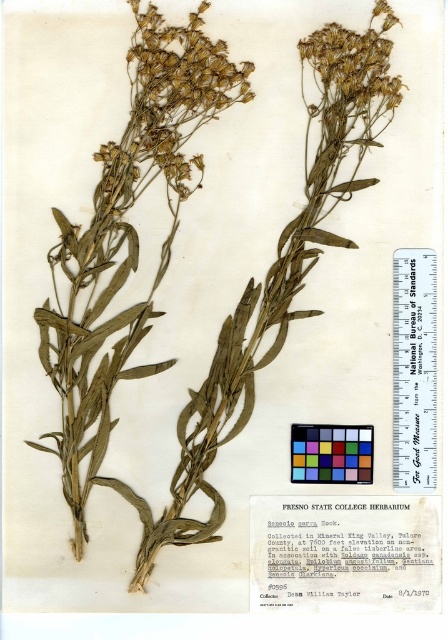
Question: Which object is positioned farthest from the metallic silver ruler at center-right?

Choices:
 (A) dry grass at upper center
 (B) dry grass at upper left

Answer: (B)

Question: Which of the following is the farthest from the observer?

Choices:
 (A) dry grass at upper left
 (B) dry grass at upper center
 (C) metallic silver ruler at center-right

Answer: (C)

Question: Which object is the closest to the dry grass at upper center?

Choices:
 (A) dry grass at upper left
 (B) metallic silver ruler at center-right

Answer: (A)

Question: Can you confirm if metallic silver ruler at center-right is thinner than dry grass at upper center?

Choices:
 (A) yes
 (B) no

Answer: (A)

Question: Does dry grass at upper left have a lesser width compared to metallic silver ruler at center-right?

Choices:
 (A) no
 (B) yes

Answer: (A)

Question: Is dry grass at upper left bigger than metallic silver ruler at center-right?

Choices:
 (A) yes
 (B) no

Answer: (A)